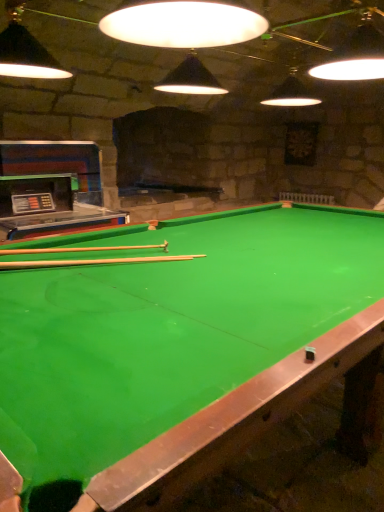
Image resolution: width=384 pixels, height=512 pixels. I want to click on free space to the back side of wooden cue at center, which is the first cue from top to bottom, so click(x=124, y=236).